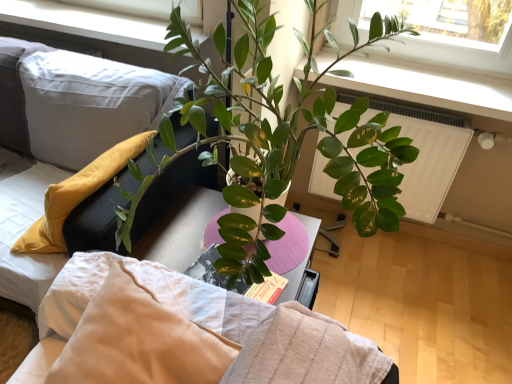
This screenshot has width=512, height=384. What do you see at coordinates (85, 22) in the screenshot? I see `white plastic window frame at upper center` at bounding box center [85, 22].

Find the location of `white plastic radiator at upper right`. white plastic radiator at upper right is located at coordinates (426, 156).

From the picture: Which object is positioned more to the left, white textured pillow at upper left or white plastic window frame at upper center?

Positioned to the left is white plastic window frame at upper center.

From the picture: From a real-world perspective, which object stands above the other?

From a 3D spatial view, white plastic window frame at upper center is above.

From the image's perspective, which is below, white textured pillow at upper left or white plastic window frame at upper center?

white textured pillow at upper left appears lower in the image.

From the picture: Does white textured pillow at upper left contain white plastic window frame at upper center?

Definitely not — white plastic window frame at upper center is not inside white textured pillow at upper left.

How distant is white textured bed at center from soft white fabric couch at left?

white textured bed at center is 7.93 inches from soft white fabric couch at left.

Find the location of a particular element. Image resolution: width=512 pixels, height=384 pixels. couch on the left of white textured bed at center is located at coordinates (83, 96).

From a real-world perspective, between white textured bed at center and soft white fabric couch at left, who is vertically lower?

From a 3D spatial view, soft white fabric couch at left is below.

Considering the positions of point (29, 176) and point (131, 89), is point (29, 176) closer or farther from the camera than point (131, 89)?

Point (29, 176) appears to be farther away from the viewer than point (131, 89).

Is white plastic window frame at upper center inside the boundaries of white textured bed at center, or outside?

The correct answer is: outside.

At what (x,y) coordinates should I click in order to perform the action: click on bed located on the right of white plastic window frame at upper center. Please return your answer as a coordinate pair (x, y). This screenshot has height=384, width=512. Looking at the image, I should click on (180, 227).

From a real-world perspective, is white plastic window frame at upper center on top of white textured bed at center?

No, from a real-world perspective, white plastic window frame at upper center is not over white textured bed at center

From the image's perspective, would you say white plastic window frame at upper center is positioned over white textured bed at center?

Yes, from the image's perspective, white plastic window frame at upper center is on top of white textured bed at center.

In terms of width, does white plastic radiator at upper right look wider or thinner when compared to soft white fabric couch at left?

In the image, white plastic radiator at upper right appears to be more narrow than soft white fabric couch at left.

From the image's perspective, which one is positioned lower, white plastic radiator at upper right or soft white fabric couch at left?

soft white fabric couch at left is shown below in the image.

Does white plastic radiator at upper right touch soft white fabric couch at left?

white plastic radiator at upper right and soft white fabric couch at left are not in contact.

Considering the relative sizes of white plastic radiator at upper right and soft white fabric couch at left in the image provided, is white plastic radiator at upper right smaller than soft white fabric couch at left?

Yes.

Could you tell me if white textured pillow at upper left is facing white textured bed at center?

No, white textured pillow at upper left is not turned towards white textured bed at center.

From a real-world perspective, who is located higher, white textured pillow at upper left or white textured bed at center?

white textured bed at center is physically above.

Considering the relative positions of white textured pillow at upper left and white textured bed at center in the image provided, is white textured pillow at upper left to the right of white textured bed at center from the viewer's perspective?

Incorrect, white textured pillow at upper left is not on the right side of white textured bed at center.

Is white plastic radiator at upper right far away from white textured pillow at upper left?

white plastic radiator at upper right is far away from white textured pillow at upper left.

Does white plastic radiator at upper right appear on the right side of white textured pillow at upper left?

Correct, you'll find white plastic radiator at upper right to the right of white textured pillow at upper left.

Would you say white plastic radiator at upper right is inside or outside white textured pillow at upper left?

white plastic radiator at upper right is not enclosed by white textured pillow at upper left.

Based on the photo, from a real-world perspective, is soft white fabric couch at left physically above white textured bed at center?

Incorrect, from a real-world perspective, soft white fabric couch at left is lower than white textured bed at center.

Does point (50, 109) appear closer or farther from the camera than point (166, 201)?

Point (50, 109) is positioned farther from the camera compared to point (166, 201).

Which object is positioned more to the right, soft white fabric couch at left or white textured bed at center?

Positioned to the right is white textured bed at center.

You are a GUI agent. You are given a task and a screenshot of the screen. Output one action in this format:
    pyautogui.click(x=<x>, y=<y>)
    Task: Click on the window frame above the white textured pillow at upper left (from a real-world perspective)
    The width and height of the screenshot is (512, 384).
    Given the screenshot: What is the action you would take?
    pyautogui.click(x=85, y=22)

Locate an element on the screen. This screenshot has width=512, height=384. bed lying in front of the soft white fabric couch at left is located at coordinates (180, 227).

Based on their spatial positions, is white textured bed at center or soft white fabric couch at left closer to white plastic window frame at upper center?

The object closer to white plastic window frame at upper center is soft white fabric couch at left.

Estimate the real-world distances between objects in this image. Which object is closer to white textured pillow at upper left, white plastic window frame at upper center or soft white fabric couch at left?

The object closer to white textured pillow at upper left is soft white fabric couch at left.

Estimate the real-world distances between objects in this image. Which object is closer to white textured bed at center, white plastic window frame at upper center or white textured pillow at upper left?

Based on the image, white textured pillow at upper left appears to be nearer to white textured bed at center.

Based on their spatial positions, is white textured pillow at upper left or white plastic radiator at upper right closer to white plastic window frame at upper center?

Among the two, white plastic radiator at upper right is located nearer to white plastic window frame at upper center.

Considering their positions, is white textured bed at center positioned further to white textured pillow at upper left than white plastic radiator at upper right?

Based on the image, white plastic radiator at upper right appears to be further to white textured pillow at upper left.

From the image, which object appears to be farther from white plastic radiator at upper right, white textured pillow at upper left or white textured bed at center?

white textured pillow at upper left lies further to white plastic radiator at upper right than the other object.

Based on their spatial positions, is white plastic window frame at upper center or white plastic radiator at upper right further from soft white fabric couch at left?

white plastic radiator at upper right.

When comparing their distances from white plastic radiator at upper right, does white plastic window frame at upper center or soft white fabric couch at left seem further?

The object further to white plastic radiator at upper right is white plastic window frame at upper center.

Where is `couch between white textured pillow at upper left and white plastic window frame at upper center in the front-back direction`? This screenshot has height=384, width=512. couch between white textured pillow at upper left and white plastic window frame at upper center in the front-back direction is located at coordinates (83, 96).

At what (x,y) coordinates should I click in order to perform the action: click on bedding located between soft white fabric couch at left and white plastic radiator at upper right in the left-right direction. Please return your answer as a coordinate pair (x, y). This screenshot has width=512, height=384. Looking at the image, I should click on (152, 292).

Find the location of `bedding between white textured bed at center and white plastic window frame at upper center in the front-back direction`. bedding between white textured bed at center and white plastic window frame at upper center in the front-back direction is located at coordinates (152, 292).

The width and height of the screenshot is (512, 384). I want to click on bedding between white plastic window frame at upper center and white plastic radiator at upper right from left to right, so click(152, 292).